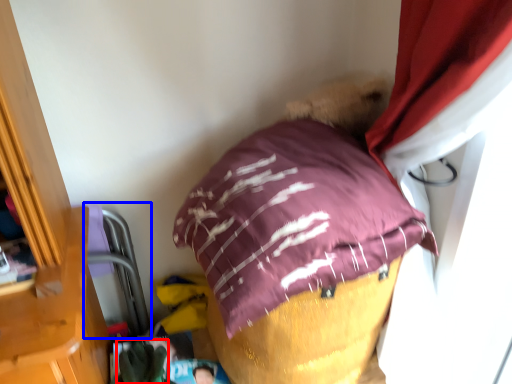
Question: Which object is closer to the camera taking this photo, clothing (highlighted by a red box) or bean bag chair (highlighted by a blue box)?

Choices:
 (A) clothing
 (B) bean bag chair

Answer: (A)